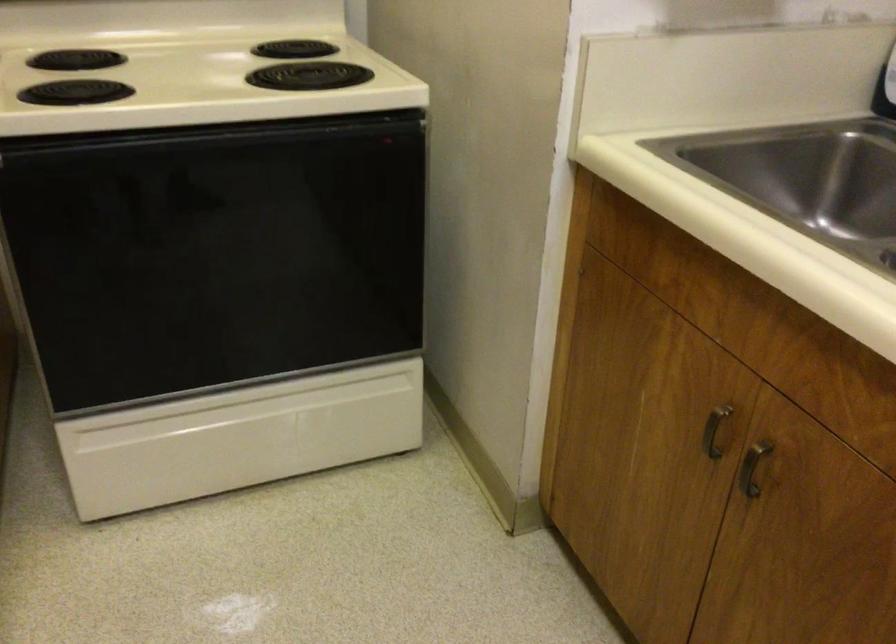
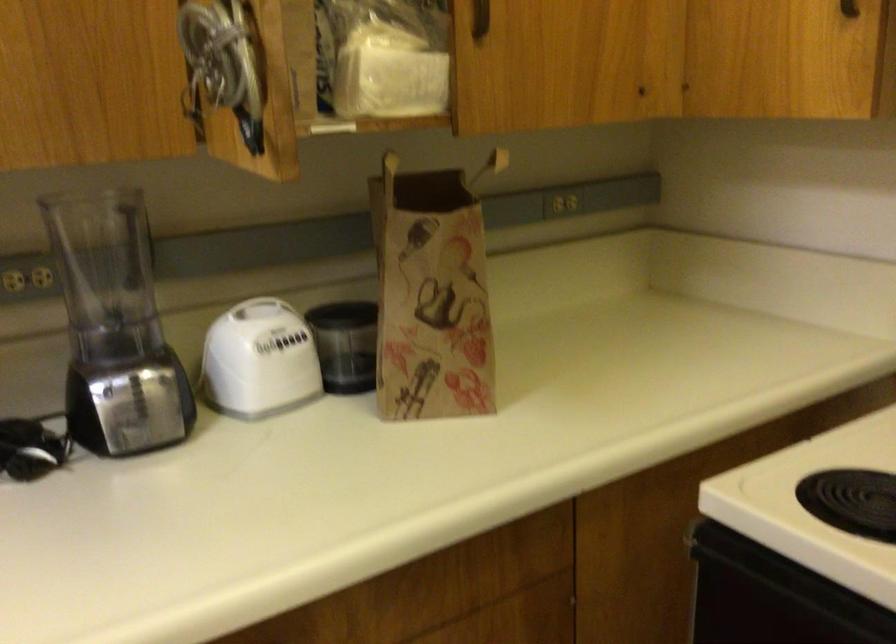
Question: How did the camera likely rotate?

Choices:
 (A) Left
 (B) Right
 (C) Up
 (D) Down

Answer: (A)